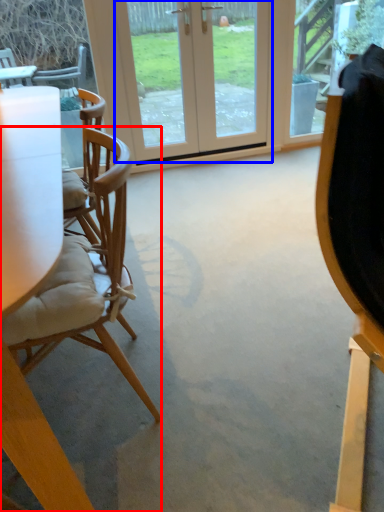
Question: Which object is further to the camera taking this photo, chair (highlighted by a red box) or door (highlighted by a blue box)?

Choices:
 (A) chair
 (B) door

Answer: (B)